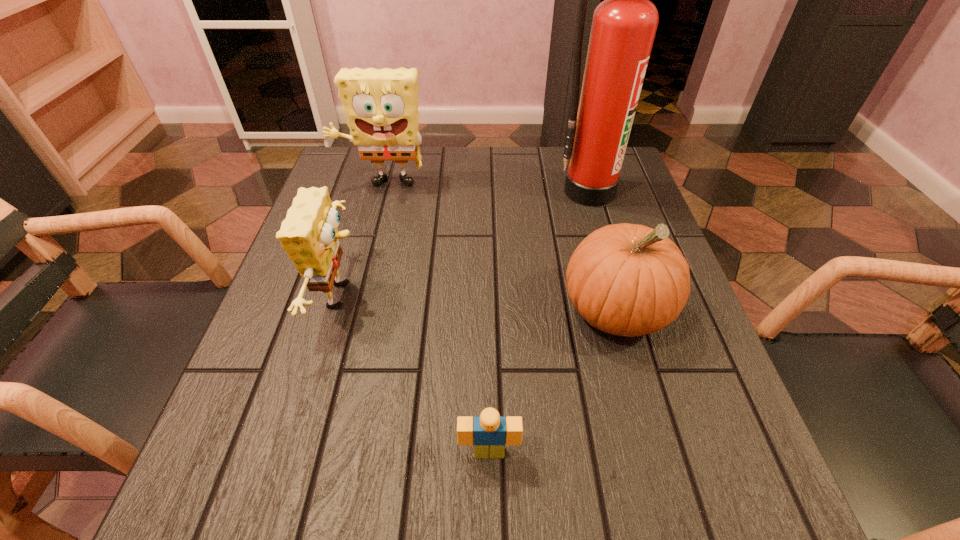
The height and width of the screenshot is (540, 960). Find the location of `the tallest object`. the tallest object is located at coordinates (624, 25).

Locate an element on the screen. This screenshot has width=960, height=540. the farther sponge is located at coordinates (381, 105).

What are the coordinates of `the fourth shortest object` in the screenshot? It's located at (381, 105).

Locate an element on the screen. pumpkin is located at coordinates (629, 280).

This screenshot has height=540, width=960. Identify the location of the nearer sponge. (309, 235).

The image size is (960, 540). Identify the location of Lego. (489, 432).

At what (x,y) coordinates should I click in order to perform the action: click on the shortest object. Please return your answer as a coordinate pair (x, y). Image resolution: width=960 pixels, height=540 pixels. Looking at the image, I should click on (489, 432).

Identify the location of blank area located with the nozzle pointing from the back of the fire extinguisher. (622, 310).

In order to click on vacant area situated on the face of the taller sponge in this screenshot , I will do `click(359, 277)`.

Identify the location of vacant space situated on the stem of the pumpkin. (652, 442).